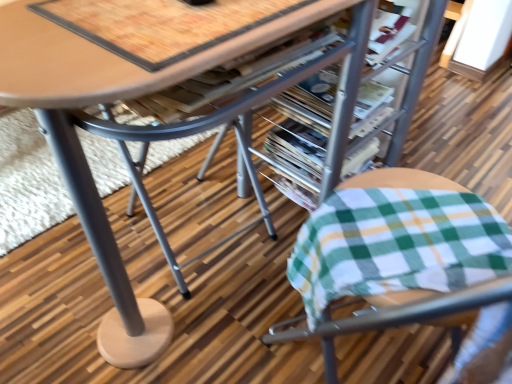
What do you see at coordinates (306, 122) in the screenshot? Image resolution: width=512 pixels, height=384 pixels. I see `metallic silver magazine at center, the first magazine positioned from the front` at bounding box center [306, 122].

Measure the distance between point (x=298, y=112) and camera.

Point (x=298, y=112) is 1.21 meters away from camera.

You are a GUI agent. You are given a task and a screenshot of the screen. Output one action in this format:
    pyautogui.click(x=<x>, y=<y>)
    Task: Click on the green plaid fabric cushion at lower right
    The height and width of the screenshot is (384, 512).
    Given the screenshot: What is the action you would take?
    pyautogui.click(x=397, y=241)

Find the location of a particular element. wooden table at center is located at coordinates (82, 164).

What do you see at coordinates (297, 149) in the screenshot? The image size is (512, 384). I see `metallic silver magazine at center, the first magazine viewed from the back` at bounding box center [297, 149].

The height and width of the screenshot is (384, 512). What are the coordinates of `metallic silver magazine at center, the first magazine viewed from the back` in the screenshot? It's located at (297, 149).

Find the location of `metallic silver magazine at center, the second magazine in the back-to-front sequence`. metallic silver magazine at center, the second magazine in the back-to-front sequence is located at coordinates [306, 122].

Is metallic silver magazine at center, the second magazine in the front-to-back sequence, closer to the viewer compared to metallic silver magazine at center, the second magazine in the back-to-front sequence?

No, metallic silver magazine at center, the second magazine in the front-to-back sequence, is behind metallic silver magazine at center, the second magazine in the back-to-front sequence.

Does point (279, 143) lie in front of point (364, 155)?

No, it is behind (364, 155).

Is metallic silver magazine at center, the first magazine viewed from the back, to the left of metallic silver magazine at center, the second magazine in the back-to-front sequence, from the viewer's perspective?

Correct, you'll find metallic silver magazine at center, the first magazine viewed from the back, to the left of metallic silver magazine at center, the second magazine in the back-to-front sequence.

Consider the image. Could metallic silver magazine at center, the first magazine positioned from the front, be considered to be inside metallic silver magazine at center, the first magazine viewed from the back?

No, metallic silver magazine at center, the first magazine positioned from the front, is not inside metallic silver magazine at center, the first magazine viewed from the back.

Which point is more forward, (283, 126) or (108, 83)?

Positioned in front is point (108, 83).

Is metallic silver magazine at center, the second magazine in the back-to-front sequence, to the left or to the right of wooden table at center in the image?

Clearly, metallic silver magazine at center, the second magazine in the back-to-front sequence, is on the right of wooden table at center in the image.

Is metallic silver magazine at center, the first magazine positioned from the front, taller or shorter than wooden table at center?

Considering their sizes, metallic silver magazine at center, the first magazine positioned from the front, has less height than wooden table at center.

At what (x,y) coordinates should I click in order to perform the action: click on table that is on the left side of metallic silver magazine at center, the first magazine positioned from the front. Please return your answer as a coordinate pair (x, y). Looking at the image, I should click on (82, 164).

Between metallic silver magazine at center, the second magazine in the back-to-front sequence, and metallic silver magazine at center, the second magazine in the front-to-back sequence, which one has smaller size?

metallic silver magazine at center, the second magazine in the back-to-front sequence.

Who is taller, metallic silver magazine at center, the first magazine positioned from the front, or metallic silver magazine at center, the second magazine in the front-to-back sequence?

metallic silver magazine at center, the second magazine in the front-to-back sequence, is taller.

Is metallic silver magazine at center, the first magazine positioned from the front, spatially inside metallic silver magazine at center, the first magazine viewed from the back, or outside of it?

metallic silver magazine at center, the first magazine positioned from the front, is not enclosed by metallic silver magazine at center, the first magazine viewed from the back.

Looking at this image, is metallic silver magazine at center, the first magazine positioned from the front, thinner than metallic silver magazine at center, the first magazine viewed from the back?

Yes, metallic silver magazine at center, the first magazine positioned from the front, is thinner than metallic silver magazine at center, the first magazine viewed from the back.

Is point (310, 152) positioned behind point (108, 248)?

Yes, point (310, 152) is farther from viewer.

Is metallic silver magazine at center, the first magazine viewed from the back, inside the boundaries of wooden table at center, or outside?

metallic silver magazine at center, the first magazine viewed from the back, is located inside wooden table at center.

Could you tell me if metallic silver magazine at center, the second magazine in the front-to-back sequence, is facing wooden table at center?

Yes, metallic silver magazine at center, the second magazine in the front-to-back sequence, is facing wooden table at center.

In the image, is metallic silver magazine at center, the second magazine in the front-to-back sequence, on the left side or the right side of wooden table at center?

Clearly, metallic silver magazine at center, the second magazine in the front-to-back sequence, is on the right of wooden table at center in the image.

Which is more to the right, wooden table at center or green plaid fabric cushion at lower right?

green plaid fabric cushion at lower right.

Find the location of a particular element. This screenshot has height=384, width=512. chair to the right of wooden table at center is located at coordinates (397, 241).

Can you confirm if wooden table at center is smaller than green plaid fabric cushion at lower right?

Incorrect, wooden table at center is not smaller in size than green plaid fabric cushion at lower right.

Between wooden table at center and green plaid fabric cushion at lower right, which one has larger width?

wooden table at center.

Which object is further away from the camera, green plaid fabric cushion at lower right or wooden table at center?

Positioned behind is green plaid fabric cushion at lower right.

Based on the photo, are green plaid fabric cushion at lower right and wooden table at center located far from each other?

No.

You are a GUI agent. You are given a task and a screenshot of the screen. Output one action in this format:
    pyautogui.click(x=<x>, y=<y>)
    Task: Click on the chair on the right of wooden table at center
    The height and width of the screenshot is (384, 512).
    Given the screenshot: What is the action you would take?
    pyautogui.click(x=397, y=241)

Consider the image. Between green plaid fabric cushion at lower right and wooden table at center, which one has smaller width?

With smaller width is green plaid fabric cushion at lower right.

Could you tell me if wooden table at center is turned towards metallic silver magazine at center, the second magazine in the front-to-back sequence?

Yes, wooden table at center faces towards metallic silver magazine at center, the second magazine in the front-to-back sequence.

Between wooden table at center and metallic silver magazine at center, the second magazine in the front-to-back sequence, which one is positioned behind?

metallic silver magazine at center, the second magazine in the front-to-back sequence, is further from the camera.

Can you confirm if wooden table at center is shorter than metallic silver magazine at center, the first magazine viewed from the back?

Incorrect, the height of wooden table at center does not fall short of that of metallic silver magazine at center, the first magazine viewed from the back.

From the picture: Is wooden table at center not within metallic silver magazine at center, the first magazine viewed from the back?

That's correct, wooden table at center is outside of metallic silver magazine at center, the first magazine viewed from the back.

At what (x,y) coordinates should I click in order to perform the action: click on magazine on the left side of metallic silver magazine at center, the second magazine in the back-to-front sequence. Please return your answer as a coordinate pair (x, y). The width and height of the screenshot is (512, 384). Looking at the image, I should click on (297, 149).

From the wooden table at center, count 2nd magazine to the right and point to it. Please provide its 2D coordinates.

[(306, 122)]

Which object lies nearer to the anchor point wooden table at center, metallic silver magazine at center, the second magazine in the back-to-front sequence, or metallic silver magazine at center, the second magazine in the front-to-back sequence?

metallic silver magazine at center, the second magazine in the back-to-front sequence.

Estimate the real-world distances between objects in this image. Which object is further from green plaid fabric cushion at lower right, wooden table at center or metallic silver magazine at center, the first magazine viewed from the back?

metallic silver magazine at center, the first magazine viewed from the back, is further to green plaid fabric cushion at lower right.

When comparing their distances from wooden table at center, does metallic silver magazine at center, the second magazine in the back-to-front sequence, or green plaid fabric cushion at lower right seem closer?

green plaid fabric cushion at lower right is closer to wooden table at center.

Considering their positions, is metallic silver magazine at center, the second magazine in the front-to-back sequence, positioned closer to wooden table at center than green plaid fabric cushion at lower right?

green plaid fabric cushion at lower right is closer to wooden table at center.

Estimate the real-world distances between objects in this image. Which object is closer to metallic silver magazine at center, the second magazine in the front-to-back sequence, metallic silver magazine at center, the first magazine positioned from the front, or wooden table at center?

metallic silver magazine at center, the first magazine positioned from the front, lies closer to metallic silver magazine at center, the second magazine in the front-to-back sequence, than the other object.

Considering their positions, is green plaid fabric cushion at lower right positioned closer to metallic silver magazine at center, the first magazine positioned from the front, than metallic silver magazine at center, the first magazine viewed from the back?

Among the two, metallic silver magazine at center, the first magazine viewed from the back, is located nearer to metallic silver magazine at center, the first magazine positioned from the front.

From the image, which object appears to be nearer to metallic silver magazine at center, the second magazine in the front-to-back sequence, metallic silver magazine at center, the second magazine in the back-to-front sequence, or green plaid fabric cushion at lower right?

metallic silver magazine at center, the second magazine in the back-to-front sequence, lies closer to metallic silver magazine at center, the second magazine in the front-to-back sequence, than the other object.

When comparing their distances from green plaid fabric cushion at lower right, does metallic silver magazine at center, the first magazine positioned from the front, or wooden table at center seem further?

Based on the image, metallic silver magazine at center, the first magazine positioned from the front, appears to be further to green plaid fabric cushion at lower right.

The image size is (512, 384). I want to click on magazine located between green plaid fabric cushion at lower right and metallic silver magazine at center, the second magazine in the front-to-back sequence, in the depth direction, so click(x=306, y=122).

Locate an element on the screen. The image size is (512, 384). magazine between wooden table at center and metallic silver magazine at center, the second magazine in the front-to-back sequence, from front to back is located at coordinates (306, 122).

At what (x,y) coordinates should I click in order to perform the action: click on chair between wooden table at center and metallic silver magazine at center, the second magazine in the front-to-back sequence, from front to back. Please return your answer as a coordinate pair (x, y). Image resolution: width=512 pixels, height=384 pixels. Looking at the image, I should click on (397, 241).

Find the location of a particular element. The width and height of the screenshot is (512, 384). chair between wooden table at center and metallic silver magazine at center, the first magazine positioned from the front, along the z-axis is located at coordinates (397, 241).